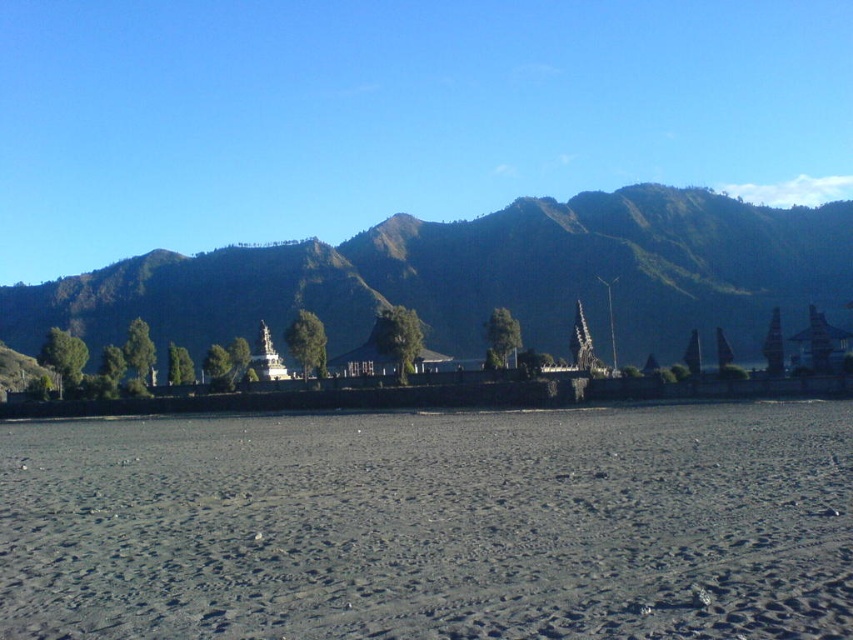
You are standing in the volcanic ash field and want to reach the Balinese structures in the midground. You have two markers labeled point A at point (476, 481) and point B at point (189, 330). Which marker is closer to your current position?

Point A at point (476, 481) is closer to the camera than point B at point (189, 330), so the marker labeled point A is closer to your current position.

You are a hiker planning to walk from the dark gray sand at center to the green grassy mountain at left. Based on the scene, which direction should you head towards?

Since the dark gray sand at center is in front of the green grassy mountain at left, you should head towards the left direction to reach the green grassy mountain at left from the dark gray sand at center.

You are a hiker standing at the edge of the dark gray sand at center. You want to place a 10 meter long tent on the sand. Is it possible?

The dark gray sand at center has a length of 9.03 meters, which is shorter than the 10 meter long tent. Therefore, the tent cannot be placed entirely on the sand.